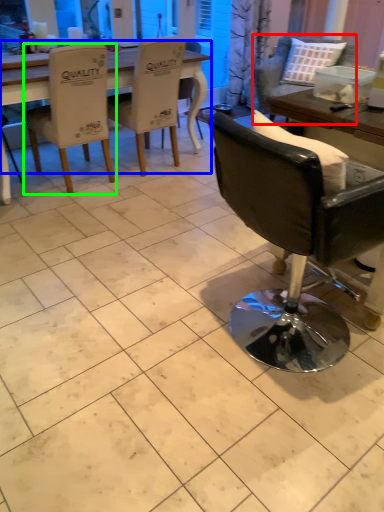
Question: Considering the real-world distances, which object is farthest from chair (highlighted by a red box)? table (highlighted by a blue box) or chair (highlighted by a green box)?

Choices:
 (A) table
 (B) chair

Answer: (B)